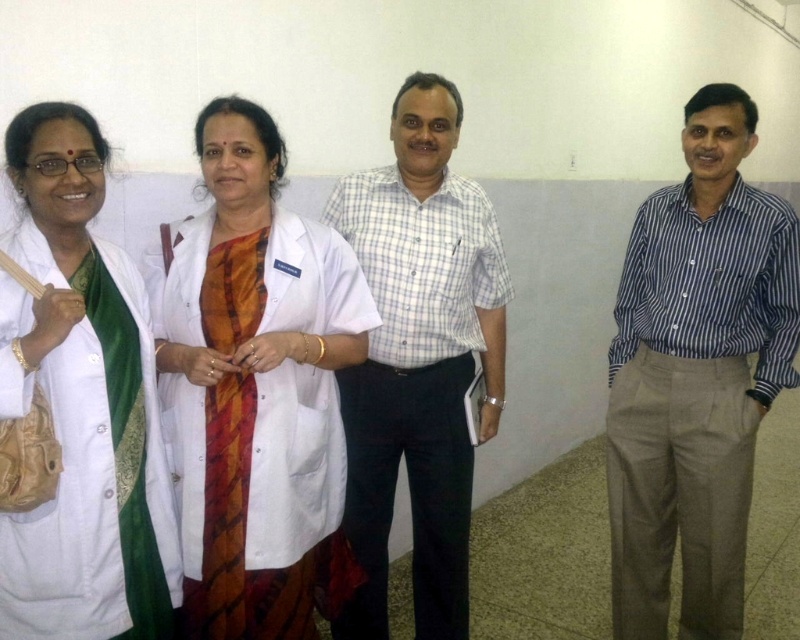
In the scene shown: Between white matte lab coat at center and white checkered shirt at center, which one is positioned higher?

white matte lab coat at center

Who is lower down, white matte lab coat at center or white checkered shirt at center?

white checkered shirt at center

I want to click on white matte lab coat at center, so click(x=256, y=388).

Is blue striped shirt at center taller than white checkered shirt at center?

Yes.

Who is shorter, blue striped shirt at center or white checkered shirt at center?

With less height is white checkered shirt at center.

Which is behind, point (668, 384) or point (466, 307)?

The point (668, 384) is behind.

You are a GUI agent. You are given a task and a screenshot of the screen. Output one action in this format:
    pyautogui.click(x=<x>, y=<y>)
    Task: Click on the blue striped shirt at center
    Image resolution: width=800 pixels, height=640 pixels.
    Given the screenshot: What is the action you would take?
    pyautogui.click(x=696, y=376)

Is blue striped shirt at center taller than white matte lab coat at left?

Indeed, blue striped shirt at center has a greater height compared to white matte lab coat at left.

Is blue striped shirt at center closer to camera compared to white matte lab coat at left?

No.

Between point (788, 256) and point (58, 141), which one is positioned behind?

The point (788, 256) is behind.

The width and height of the screenshot is (800, 640). I want to click on blue striped shirt at center, so click(696, 376).